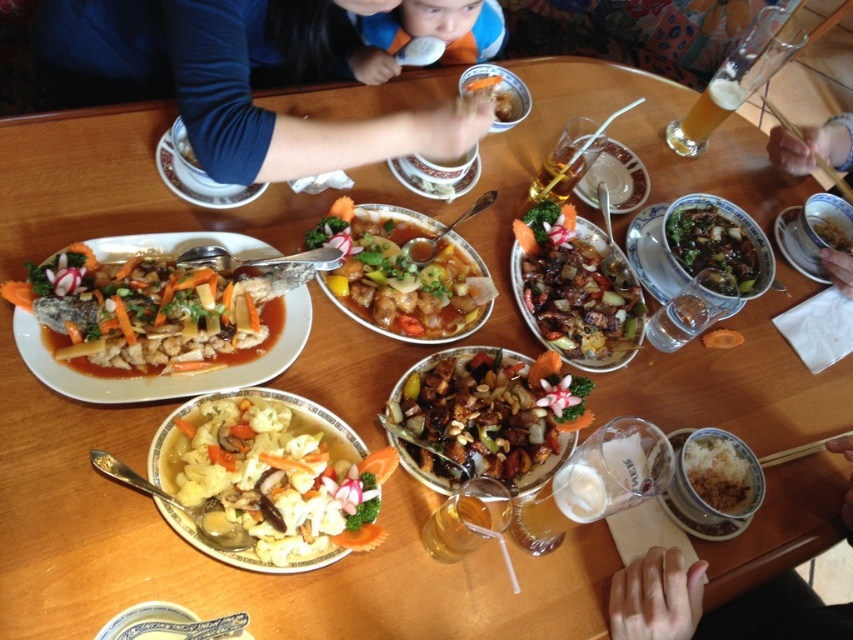
You are a photographer trying to capture the perfect shot of the dining table. You notice two points marked on the table at coordinates point (547, 317) and point (573, 173). If you want to focus on the closer point to the camera, which coordinate should you aim your camera at?

Point (547, 317) is closer to the camera than point (573, 173), so you should aim your camera at point (547, 317) to focus on the closer one.

You are a food delivery person who needs to place a protective cover over the table to prevent spills. The cover must be large enough to cover both the brown glossy meat at center and the translucent glass at upper center. Based on their sizes, will the cover that is 1.2 meters wide be sufficient?

The brown glossy meat at center has a larger width than the translucent glass at upper center. Since the cover is 1.2 meters wide, it should be sufficient to cover both items as long as their combined or individual widths do not exceed the cover size. However, the exact dimensions of the items are not provided, so this is an estimate based on the given comparison.

You are a server at the restaurant and need to place a new dish on the table. The dish is too hot to handle, so you must place it on the table without touching it. You can only use the space not occupied by the blue fabric shirt at upper center and the matte brown bowl at upper right. Is there enough space to place the dish?

The blue fabric shirt at upper center is positioned over the matte brown bowl at upper right, meaning the bowl is underneath the shirt. Since the shirt is on top, the space below it where the bowl is located is already occupied. However, there might be other areas on the table not covered by either object where you can place the dish safely.